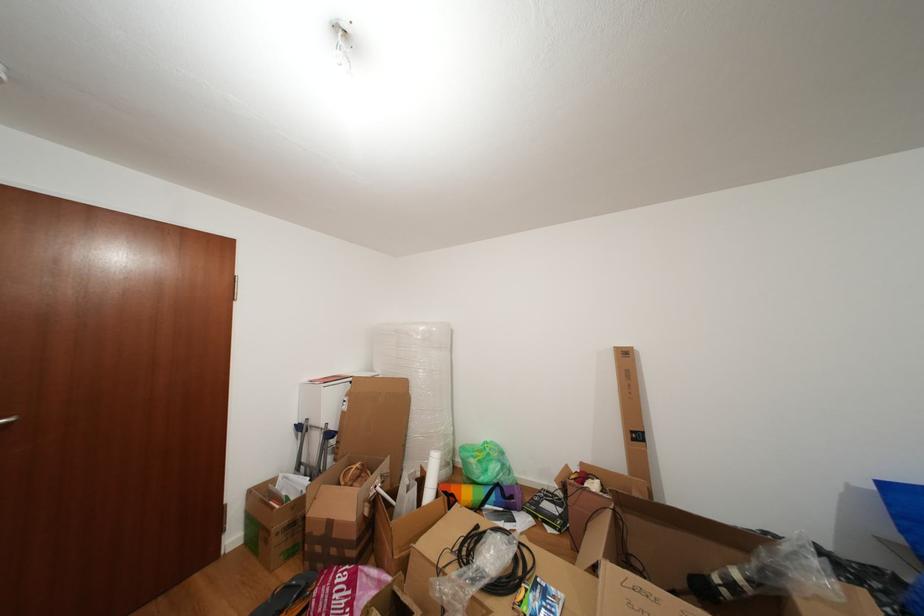
Which object does [341,515] point to?

It corresponds to the taped cardboard box in the image.